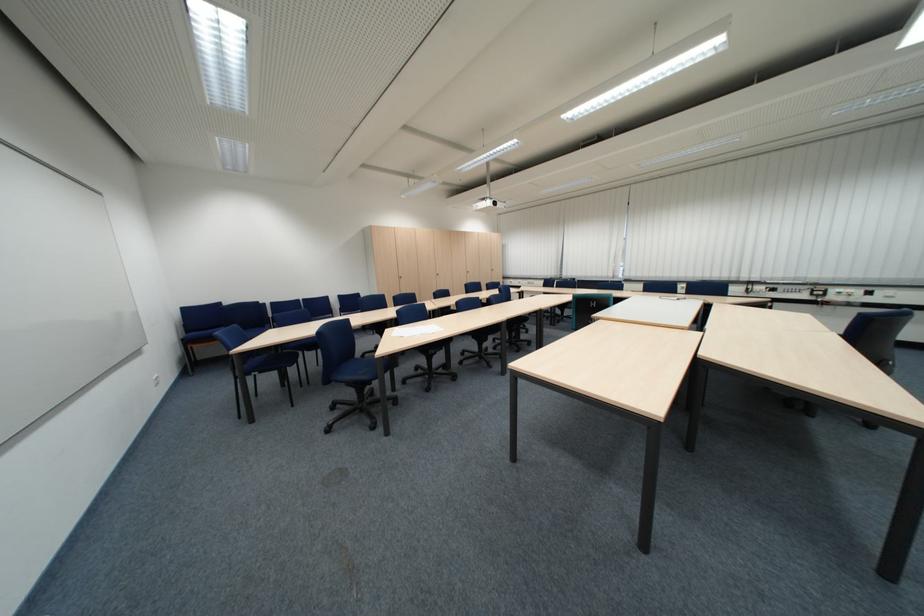
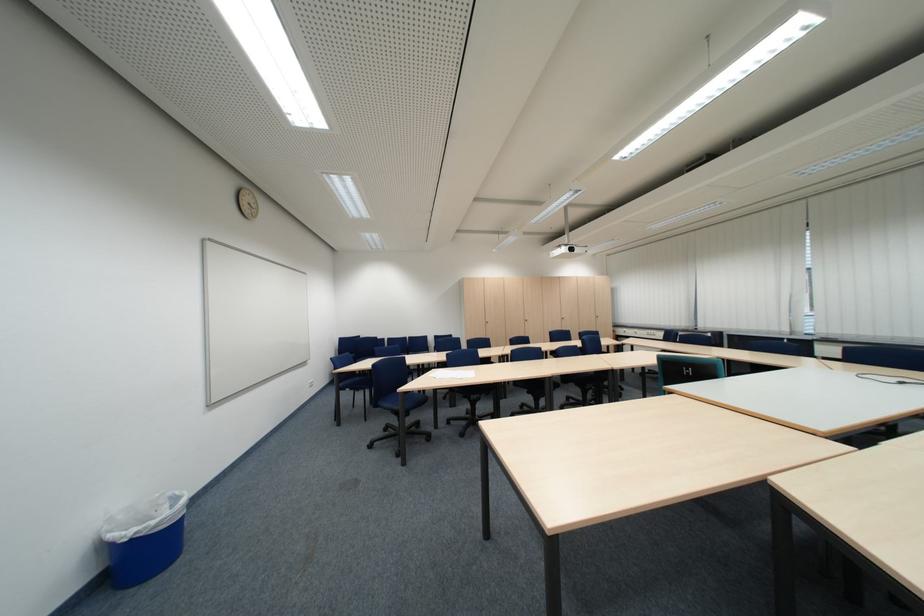
The point at (396, 359) is marked in the first image. Where is the corresponding point in the second image?

(419, 394)